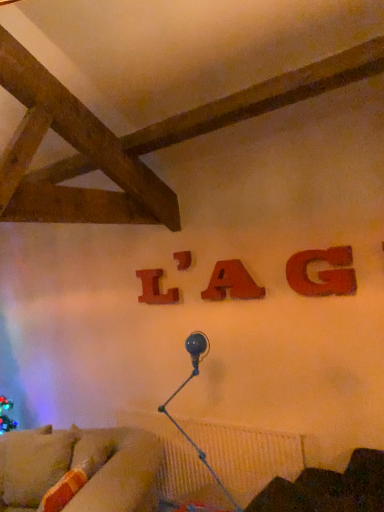
Question: Is velvet beige couch at lower left at the back of matte wood letter g at upper right, the fourth alphabet when ordered from back to front?

Choices:
 (A) yes
 (B) no

Answer: (B)

Question: Is matte wood letter g at upper right, placed as the 1th alphabet when sorted from right to left, smaller than velvet beige couch at lower left?

Choices:
 (A) no
 (B) yes

Answer: (B)

Question: Does matte wood letter g at upper right, placed as the 1th alphabet when sorted from right to left, have a greater height compared to velvet beige couch at lower left?

Choices:
 (A) no
 (B) yes

Answer: (A)

Question: Would you say matte wood letter g at upper right, placed as the 1th alphabet when sorted from right to left, contains velvet beige couch at lower left?

Choices:
 (A) yes
 (B) no

Answer: (B)

Question: From a real-world perspective, does matte wood letter g at upper right, positioned as the first alphabet in front-to-back order, sit lower than velvet beige couch at lower left?

Choices:
 (A) yes
 (B) no

Answer: (B)

Question: From the image's perspective, is velvet dark brown armchair at lower right above or below wooden letter a at center, the 2th alphabet from the right?

Choices:
 (A) above
 (B) below

Answer: (B)

Question: Is velvet dark brown armchair at lower right inside the boundaries of wooden letter a at center, the third alphabet when ordered from left to right, or outside?

Choices:
 (A) inside
 (B) outside

Answer: (B)

Question: From a real-world perspective, is velvet dark brown armchair at lower right physically located above or below wooden letter a at center, the 3th alphabet positioned from the back?

Choices:
 (A) above
 (B) below

Answer: (B)

Question: Considering their positions, is velvet dark brown armchair at lower right located in front of or behind wooden letter a at center, the third alphabet when ordered from left to right?

Choices:
 (A) front
 (B) behind

Answer: (A)

Question: Considering the relative positions of velvet beige couch at lower left and matte wood letter g at upper right, positioned as the first alphabet in front-to-back order, in the image provided, is velvet beige couch at lower left to the left or to the right of matte wood letter g at upper right, positioned as the first alphabet in front-to-back order,?

Choices:
 (A) right
 (B) left

Answer: (B)

Question: In terms of height, does velvet beige couch at lower left look taller or shorter compared to matte wood letter g at upper right, placed as the 1th alphabet when sorted from right to left?

Choices:
 (A) tall
 (B) short

Answer: (A)

Question: From the image's perspective, is velvet beige couch at lower left located above or below matte wood letter g at upper right, the 4th alphabet viewed from the left?

Choices:
 (A) above
 (B) below

Answer: (B)

Question: Would you say velvet beige couch at lower left is inside or outside matte wood letter g at upper right, the 4th alphabet viewed from the left?

Choices:
 (A) inside
 (B) outside

Answer: (B)

Question: Does point (182, 260) appear closer or farther from the camera than point (119, 500)?

Choices:
 (A) farther
 (B) closer

Answer: (A)

Question: In terms of size, does wooden letter at center, arranged as the 2th alphabet when viewed from the back, appear bigger or smaller than velvet beige couch at lower left?

Choices:
 (A) small
 (B) big

Answer: (A)